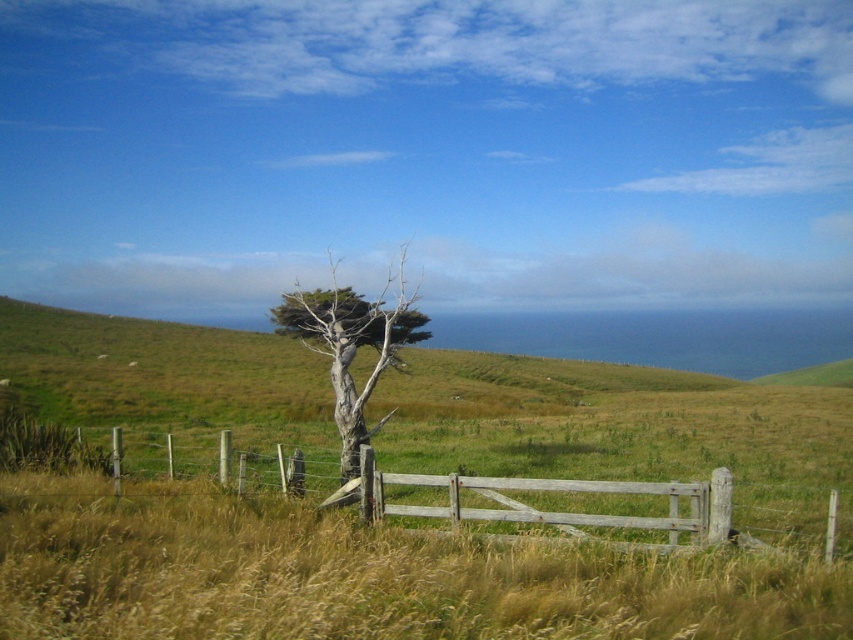
Question: Which point is farther from the camera taking this photo?

Choices:
 (A) (672, 486)
 (B) (317, 323)

Answer: (B)

Question: Can you confirm if weathered wood gate at center is smaller than gray textured tree at center?

Choices:
 (A) no
 (B) yes

Answer: (B)

Question: In this image, where is weathered wood gate at center located relative to gray textured tree at center?

Choices:
 (A) left
 (B) right

Answer: (B)

Question: Is weathered wood gate at center positioned at the back of gray textured tree at center?

Choices:
 (A) yes
 (B) no

Answer: (B)

Question: Among these objects, which one is farthest from the camera?

Choices:
 (A) gray textured tree at center
 (B) weathered wood gate at center

Answer: (A)